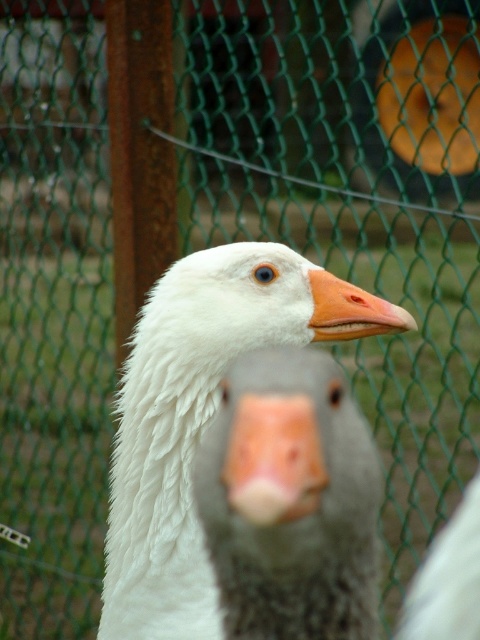
Consider the image. You are a photographer trying to capture a closeup of the orange matte beak at center. However, the gray matte goose at center is blocking your view. Can you determine if the beak is visible from your current position?

The gray matte goose at center is much taller than the orange matte beak at center, so the beak might be partially or fully obscured by the goose. Adjust your angle or move closer to ensure visibility.